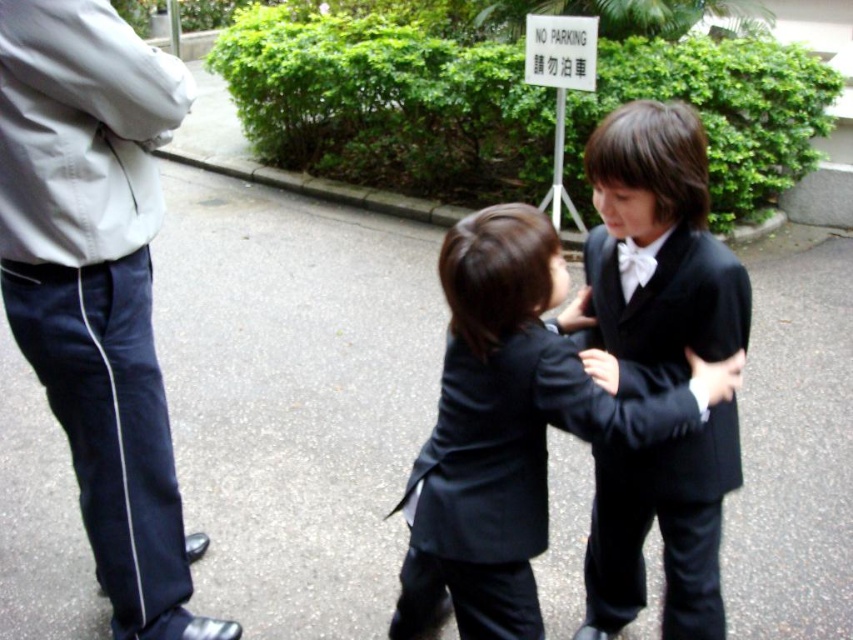
Question: Which point is farther to the camera?

Choices:
 (A) (74, 120)
 (B) (695, 241)

Answer: (A)

Question: Which of these objects is positioned farthest from the matte black suit at center?

Choices:
 (A) black satin suit at center
 (B) white cotton jacket at upper left

Answer: (B)

Question: Which of the following is the farthest from the observer?

Choices:
 (A) white cotton jacket at upper left
 (B) matte black suit at center

Answer: (A)

Question: Is black satin suit at center to the left of white satin bowtie at center from the viewer's perspective?

Choices:
 (A) no
 (B) yes

Answer: (A)

Question: Is white cotton jacket at upper left positioned behind black satin suit at center?

Choices:
 (A) yes
 (B) no

Answer: (A)

Question: Does white cotton jacket at upper left have a larger size compared to white satin bowtie at center?

Choices:
 (A) no
 (B) yes

Answer: (B)